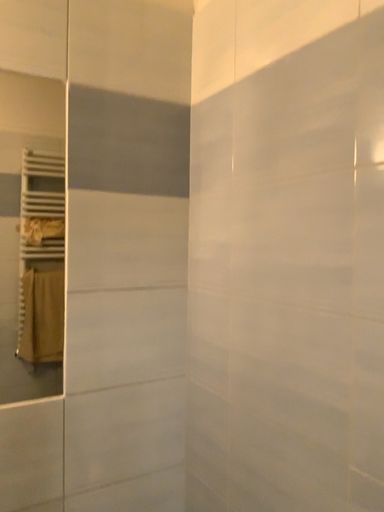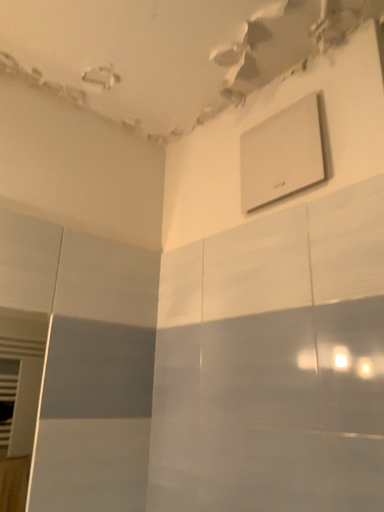
Question: Which way did the camera rotate in the video?

Choices:
 (A) rotated upward
 (B) rotated downward

Answer: (A)